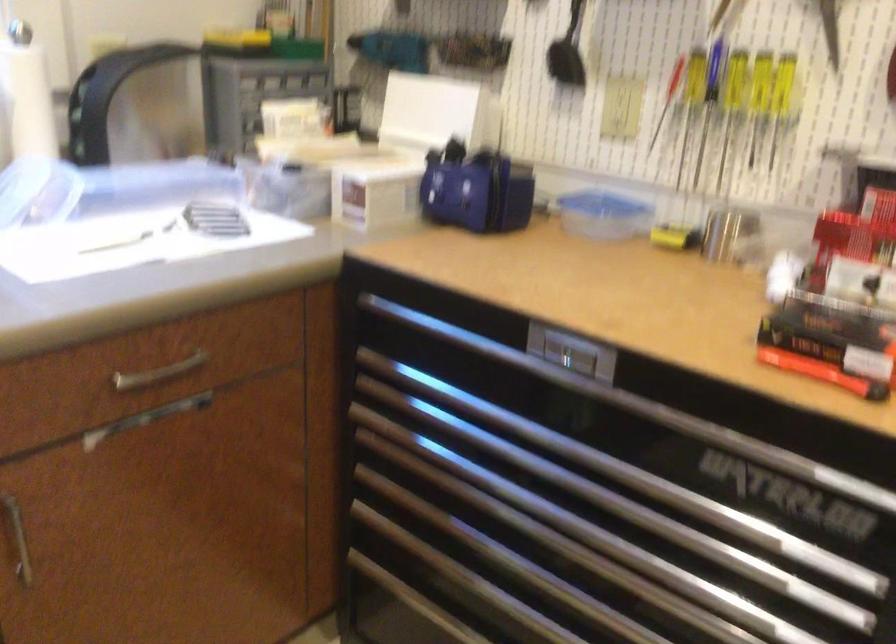
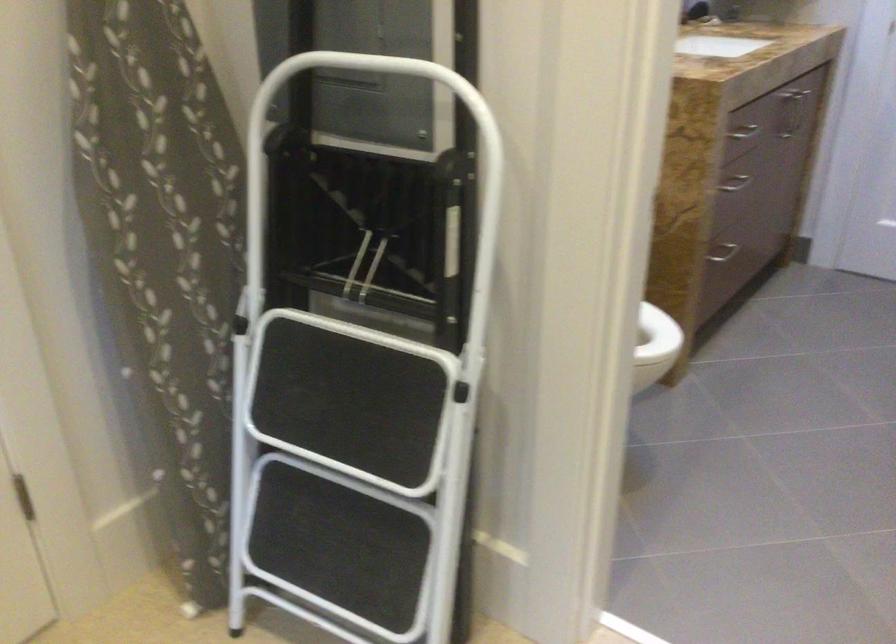
The first image is from the beginning of the video and the second image is from the end. How did the camera likely rotate when shooting the video?

The rotation direction of the camera is right-down.